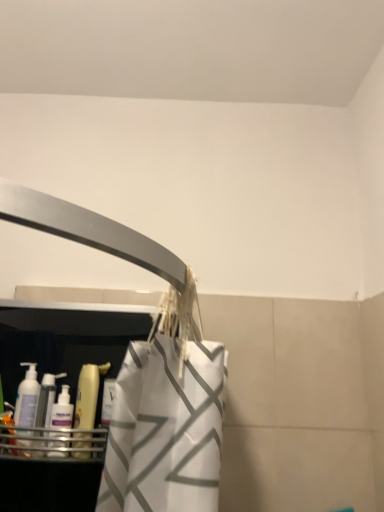
I want to click on translucent plastic bottle at left, which ranks as the second cleaning product in left-to-right order, so click(86, 408).

In order to face translucent plastic bottle at left, which ranks as the second cleaning product in left-to-right order, should I rotate leftwards or rightwards?

To face it directly, rotate left by 13.414 degrees.

This screenshot has width=384, height=512. Describe the element at coordinates (86, 408) in the screenshot. I see `translucent plastic bottle at left, which ranks as the second cleaning product in left-to-right order` at that location.

I want to click on translucent plastic bottle at left, arranged as the second cleaning product when viewed from the right, so (47, 399).

Describe the element at coordinates (47, 399) in the screenshot. I see `translucent plastic bottle at left, arranged as the second cleaning product when viewed from the right` at that location.

In order to face translucent plastic bottle at left, arranged as the second cleaning product when viewed from the right, should I rotate leftwards or rightwards?

To align with it, rotate left about 18.925°.

Where is `translucent plastic bottle at left, which ranks as the second cleaning product in left-to-right order`? This screenshot has height=512, width=384. translucent plastic bottle at left, which ranks as the second cleaning product in left-to-right order is located at coordinates (86, 408).

Can you confirm if translucent plastic bottle at left, which is counted as the 1th cleaning product, starting from the left, is positioned to the right of translucent plastic bottle at left, which ranks as the second cleaning product in left-to-right order?

No.

Considering the positions of objects translucent plastic bottle at left, arranged as the second cleaning product when viewed from the right, and translucent plastic bottle at left, the first cleaning product positioned from the right, in the image provided, who is in front, translucent plastic bottle at left, arranged as the second cleaning product when viewed from the right, or translucent plastic bottle at left, the first cleaning product positioned from the right,?

translucent plastic bottle at left, arranged as the second cleaning product when viewed from the right.

Does point (44, 387) lie in front of point (83, 404)?

No, (44, 387) is behind (83, 404).

From the image's perspective, which is above, translucent plastic bottle at left, arranged as the second cleaning product when viewed from the right, or translucent plastic bottle at left, which ranks as the second cleaning product in left-to-right order?

translucent plastic bottle at left, which ranks as the second cleaning product in left-to-right order, is shown above in the image.

From a real-world perspective, is translucent plastic bottle at left, which is counted as the 1th cleaning product, starting from the left, located higher than translucent plastic bottle at left, the first cleaning product positioned from the right?

Incorrect, from a real-world perspective, translucent plastic bottle at left, which is counted as the 1th cleaning product, starting from the left, is lower than translucent plastic bottle at left, the first cleaning product positioned from the right.

Which object is thinner, translucent plastic bottle at left, arranged as the second cleaning product when viewed from the right, or translucent plastic bottle at left, which ranks as the second cleaning product in left-to-right order?

translucent plastic bottle at left, which ranks as the second cleaning product in left-to-right order.

Between translucent plastic bottle at left, arranged as the second cleaning product when viewed from the right, and translucent plastic bottle at left, the first cleaning product positioned from the right, which one has more height?

With more height is translucent plastic bottle at left, the first cleaning product positioned from the right.

Considering the relative sizes of translucent plastic bottle at left, arranged as the second cleaning product when viewed from the right, and translucent plastic bottle at left, the first cleaning product positioned from the right, in the image provided, is translucent plastic bottle at left, arranged as the second cleaning product when viewed from the right, bigger than translucent plastic bottle at left, the first cleaning product positioned from the right,?

Actually, translucent plastic bottle at left, arranged as the second cleaning product when viewed from the right, might be smaller than translucent plastic bottle at left, the first cleaning product positioned from the right.

Is translucent plastic bottle at left, the first cleaning product positioned from the right, inside translucent plastic bottle at left, arranged as the second cleaning product when viewed from the right?

No, translucent plastic bottle at left, the first cleaning product positioned from the right, is not inside translucent plastic bottle at left, arranged as the second cleaning product when viewed from the right.

Are translucent plastic bottle at left, arranged as the second cleaning product when viewed from the right, and translucent plastic bottle at left, the first cleaning product positioned from the right, making contact?

Indeed, translucent plastic bottle at left, arranged as the second cleaning product when viewed from the right, and translucent plastic bottle at left, the first cleaning product positioned from the right, are beside each other and touching.

Is translucent plastic bottle at left, arranged as the second cleaning product when viewed from the right, aimed at translucent plastic bottle at left, the first cleaning product positioned from the right?

No, translucent plastic bottle at left, arranged as the second cleaning product when viewed from the right, is not turned towards translucent plastic bottle at left, the first cleaning product positioned from the right.

How many degrees apart are the facing directions of translucent plastic bottle at left, arranged as the second cleaning product when viewed from the right, and translucent plastic bottle at left, which ranks as the second cleaning product in left-to-right order?

They differ by 0.00422 degrees in their facing directions.

Image resolution: width=384 pixels, height=512 pixels. I want to click on cleaning product on the left of translucent plastic bottle at left, which ranks as the second cleaning product in left-to-right order, so click(x=47, y=399).

Between translucent plastic bottle at left, which ranks as the second cleaning product in left-to-right order, and translucent plastic bottle at left, arranged as the second cleaning product when viewed from the right, which one appears on the right side from the viewer's perspective?

Positioned to the right is translucent plastic bottle at left, which ranks as the second cleaning product in left-to-right order.

Considering the relative positions of translucent plastic bottle at left, which ranks as the second cleaning product in left-to-right order, and translucent plastic bottle at left, arranged as the second cleaning product when viewed from the right, in the image provided, is translucent plastic bottle at left, which ranks as the second cleaning product in left-to-right order, in front of translucent plastic bottle at left, arranged as the second cleaning product when viewed from the right,?

No, translucent plastic bottle at left, which ranks as the second cleaning product in left-to-right order, is further to the viewer.

Is point (84, 403) less distant than point (45, 435)?

No, (84, 403) is behind (45, 435).

Looking at this image, from the image's perspective, would you say translucent plastic bottle at left, the first cleaning product positioned from the right, is positioned over translucent plastic bottle at left, arranged as the second cleaning product when viewed from the right?

Indeed, from the image's perspective, translucent plastic bottle at left, the first cleaning product positioned from the right, is shown above translucent plastic bottle at left, arranged as the second cleaning product when viewed from the right.

From a real-world perspective, between translucent plastic bottle at left, which ranks as the second cleaning product in left-to-right order, and translucent plastic bottle at left, which is counted as the 1th cleaning product, starting from the left, who is vertically lower?

Result: From a 3D spatial view, translucent plastic bottle at left, which is counted as the 1th cleaning product, starting from the left, is below.

Looking at their sizes, would you say translucent plastic bottle at left, the first cleaning product positioned from the right, is wider or thinner than translucent plastic bottle at left, arranged as the second cleaning product when viewed from the right?

Clearly, translucent plastic bottle at left, the first cleaning product positioned from the right, has less width compared to translucent plastic bottle at left, arranged as the second cleaning product when viewed from the right.

In the scene shown: Between translucent plastic bottle at left, which ranks as the second cleaning product in left-to-right order, and translucent plastic bottle at left, which is counted as the 1th cleaning product, starting from the left, which one has more height?

Standing taller between the two is translucent plastic bottle at left, which ranks as the second cleaning product in left-to-right order.

Based on their sizes in the image, would you say translucent plastic bottle at left, which ranks as the second cleaning product in left-to-right order, is bigger or smaller than translucent plastic bottle at left, arranged as the second cleaning product when viewed from the right?

Considering their sizes, translucent plastic bottle at left, which ranks as the second cleaning product in left-to-right order, takes up more space than translucent plastic bottle at left, arranged as the second cleaning product when viewed from the right.

Is translucent plastic bottle at left, the first cleaning product positioned from the right, situated inside translucent plastic bottle at left, which is counted as the 1th cleaning product, starting from the left, or outside?

translucent plastic bottle at left, the first cleaning product positioned from the right, is not enclosed by translucent plastic bottle at left, which is counted as the 1th cleaning product, starting from the left.

Is translucent plastic bottle at left, which ranks as the second cleaning product in left-to-right order, positioned far away from translucent plastic bottle at left, arranged as the second cleaning product when viewed from the right?

That's not correct — translucent plastic bottle at left, which ranks as the second cleaning product in left-to-right order, is a little close to translucent plastic bottle at left, arranged as the second cleaning product when viewed from the right.

Is translucent plastic bottle at left, which ranks as the second cleaning product in left-to-right order, looking in the opposite direction of translucent plastic bottle at left, which is counted as the 1th cleaning product, starting from the left?

No, translucent plastic bottle at left, which ranks as the second cleaning product in left-to-right order, is not facing away from translucent plastic bottle at left, which is counted as the 1th cleaning product, starting from the left.

In order to click on cleaning product to the left of translucent plastic bottle at left, which ranks as the second cleaning product in left-to-right order in this screenshot , I will do `click(47, 399)`.

You are a GUI agent. You are given a task and a screenshot of the screen. Output one action in this format:
    pyautogui.click(x=<x>, y=<y>)
    Task: Click on the cleaning product that appears on the left of translucent plastic bottle at left, the first cleaning product positioned from the right
    The width and height of the screenshot is (384, 512).
    Given the screenshot: What is the action you would take?
    pyautogui.click(x=47, y=399)

In the image, there is a translucent plastic bottle at left, which ranks as the second cleaning product in left-to-right order. At what (x,y) coordinates should I click in order to perform the action: click on cleaning product below it (from the image's perspective). Please return your answer as a coordinate pair (x, y). The image size is (384, 512). Looking at the image, I should click on (47, 399).